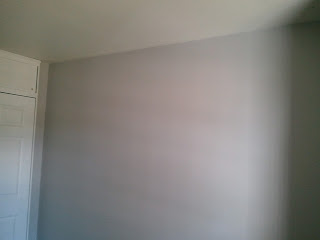
The image size is (320, 240). Find the location of `door trim`. door trim is located at coordinates (22, 92).